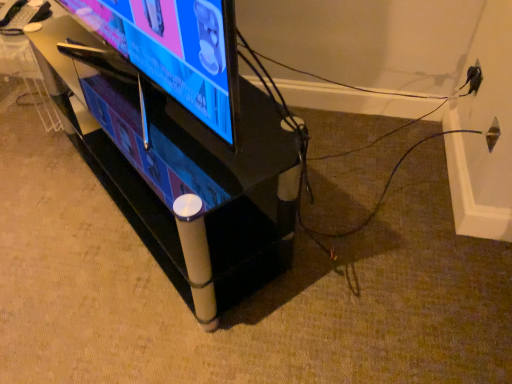
The width and height of the screenshot is (512, 384). In order to click on vacant area to the right of black glossy tv stand at center in this screenshot , I will do `click(378, 213)`.